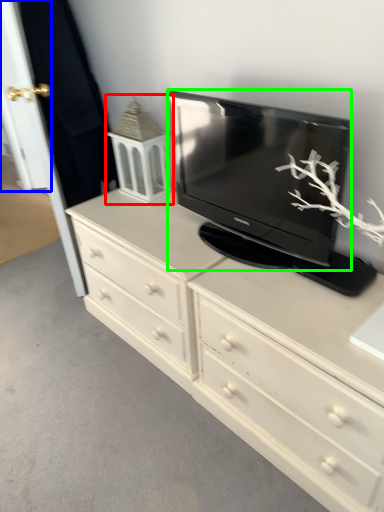
Question: Which object is positioned farthest from tv cabinet (highlighted by a red box)? Select from door (highlighted by a blue box) and television (highlighted by a green box).

Choices:
 (A) door
 (B) television

Answer: (A)